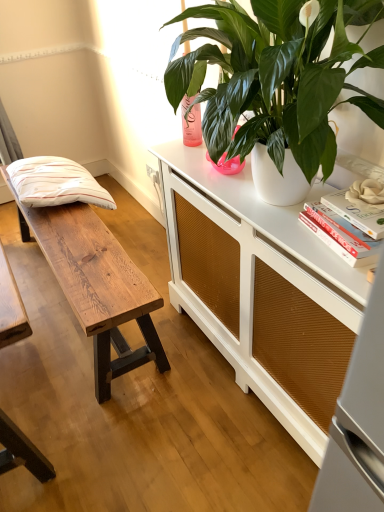
Identify the location of vacant area situated to the left side of white matte book at upper right, the 1th book ordered from the bottom. The width and height of the screenshot is (384, 512). (289, 228).